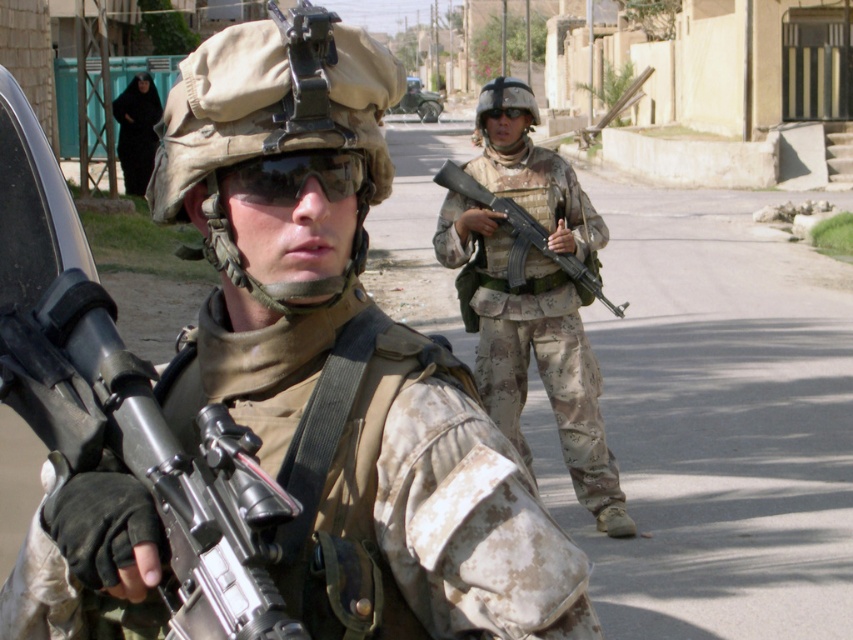
Is matte black rifle at center thinner than camouflage fabric uniform at center?

Indeed, matte black rifle at center has a lesser width compared to camouflage fabric uniform at center.

Who is more distant from viewer, (190,493) or (503,241)?

Point (503,241)

Find the location of a particular element. The image size is (853, 640). matte black rifle at center is located at coordinates (151, 458).

Between camouflage uniform at center and matte black rifle at center, which one is positioned higher?

camouflage uniform at center

Can you confirm if camouflage uniform at center is thinner than matte black rifle at center?

Incorrect, camouflage uniform at center's width is not less than matte black rifle at center's.

Is point (206, 326) farther from camera compared to point (73, 458)?

Yes, point (206, 326) is farther from viewer.

Find the location of a particular element. The width and height of the screenshot is (853, 640). camouflage uniform at center is located at coordinates (273, 212).

Which is behind, point (555, 580) or point (508, 198)?

The point (508, 198) is behind.

Is camouflage uniform at center positioned before camouflage-patterned rifle at center?

Yes, it is in front of camouflage-patterned rifle at center.

Is point (527, 557) closer to viewer compared to point (618, 305)?

That is True.

At what (x,y) coordinates should I click in order to perform the action: click on camouflage uniform at center. Please return your answer as a coordinate pair (x, y). Looking at the image, I should click on (273, 212).